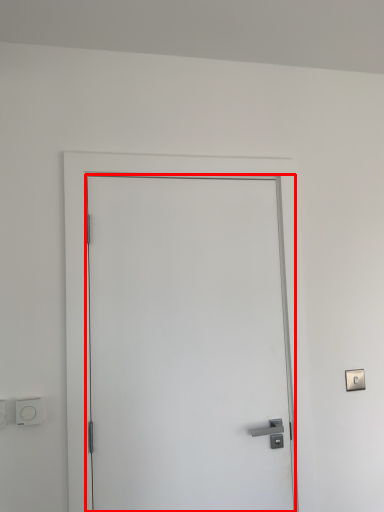
Question: In this image, where is door (annotated by the red box) located relative to light switch?

Choices:
 (A) left
 (B) right

Answer: (B)